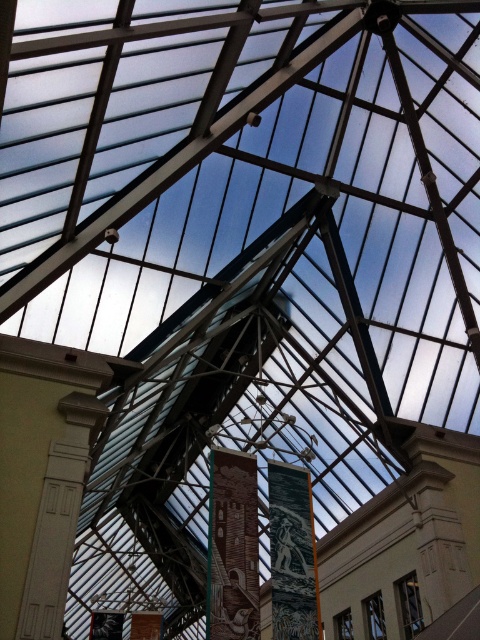
Which is below, brick textured pillar at center or dark green textured tapestry at center?

dark green textured tapestry at center is lower down.

Is point (240, 538) positioned behind point (305, 500)?

No, (240, 538) is closer to viewer.

At what (x,y) coordinates should I click in order to perform the action: click on brick textured pillar at center. Please return your answer as a coordinate pair (x, y). Looking at the image, I should click on (232, 547).

Can you confirm if white carved stone pillar at left is thinner than dark green textured tapestry at center?

Yes, white carved stone pillar at left is thinner than dark green textured tapestry at center.

Can you confirm if white carved stone pillar at left is bigger than dark green textured tapestry at center?

Actually, white carved stone pillar at left might be smaller than dark green textured tapestry at center.

Is point (24, 625) positioned before point (274, 532)?

Yes.

Locate an element on the screen. Image resolution: width=480 pixels, height=640 pixels. white carved stone pillar at left is located at coordinates (58, 516).

Between white carved stone pillar at left and brick textured pillar at center, which one is positioned higher?

brick textured pillar at center is higher up.

Who is positioned more to the left, white carved stone pillar at left or brick textured pillar at center?

white carved stone pillar at left is more to the left.

Where is `white carved stone pillar at left`? white carved stone pillar at left is located at coordinates (58, 516).